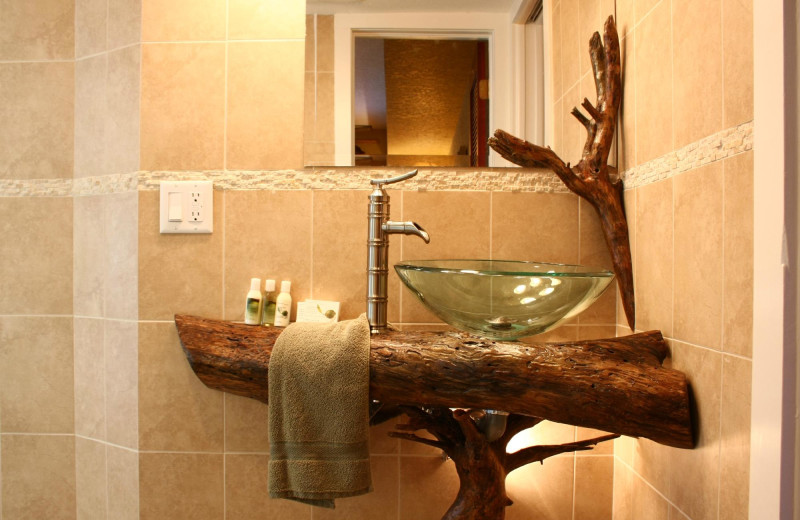
Identify the location of electrical outlet. (194, 194), (202, 212).